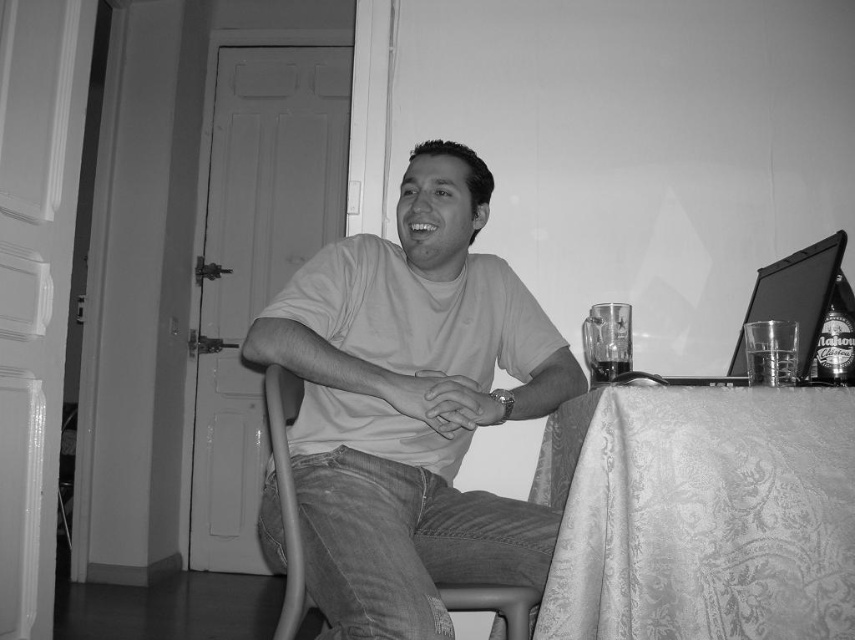
You are standing in the room where the man is seated. There are two points marked in the image. The first point is at coordinates point (282, 499) and the second point is at point (824, 337). From your perspective, which point is closer to you?

Point (282, 499) is in front of point (824, 337), so it is closer to you.

You are a photographer trying to capture the translucent glass bottle at right in the image. The focus point of your camera is currently set to point at coordinates (836, 337). Is this point on the bottle?

Yes, the point at coordinates (836, 337) is on the translucent glass bottle at right, as stated in the description.